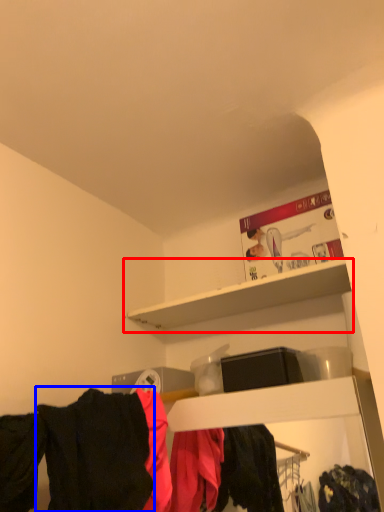
Question: Which object is further to the camera taking this photo, shelf (highlighted by a red box) or clothing (highlighted by a blue box)?

Choices:
 (A) shelf
 (B) clothing

Answer: (A)